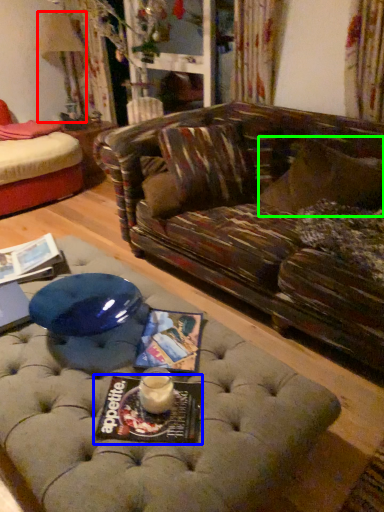
Question: Estimate the real-world distances between objects in this image. Which object is closer to lamp (highlighted by a red box), magazine (highlighted by a blue box) or pillow (highlighted by a green box)?

Choices:
 (A) magazine
 (B) pillow

Answer: (B)